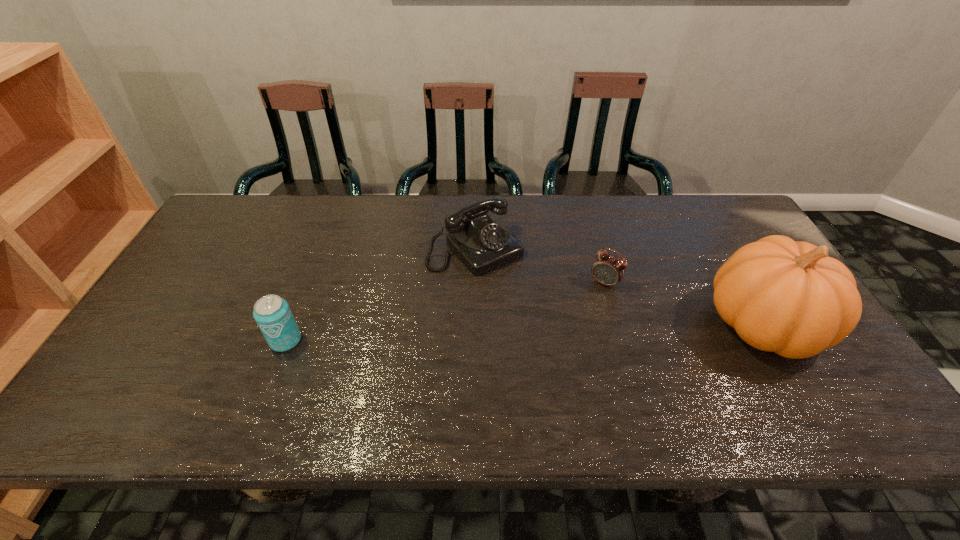
Image resolution: width=960 pixels, height=540 pixels. In order to click on free area in between the leftmost object and the telephone in this screenshot , I will do `click(380, 295)`.

You are a GUI agent. You are given a task and a screenshot of the screen. Output one action in this format:
    pyautogui.click(x=<x>, y=<y>)
    Task: Click on the free spot between the alarm clock and the telephone
    This screenshot has height=540, width=960.
    Given the screenshot: What is the action you would take?
    pyautogui.click(x=540, y=266)

Where is `free space between the beer can and the telephone`? The width and height of the screenshot is (960, 540). free space between the beer can and the telephone is located at coordinates (380, 295).

Select which object appears as the second closest to the second object from right to left. Please provide its 2D coordinates. Your answer should be formatted as a tuple, i.e. [(x, y)], where the tuple contains the x and y coordinates of a point satisfying the conditions above.

[(784, 296)]

This screenshot has height=540, width=960. In order to click on the second closest object to the beer can in this screenshot , I will do `click(607, 269)`.

Identify the location of free space that satisfies the following two spatial constraints: 1. on the back side of the second object from right to left; 2. on the right side of the leftmost object. (308, 282).

The image size is (960, 540). I want to click on free point that satisfies the following two spatial constraints: 1. on the front side of the second object from right to left; 2. on the left side of the rightmost object, so click(616, 325).

This screenshot has width=960, height=540. Find the location of `vacant position in the image that satisfies the following two spatial constraints: 1. on the back side of the pumpkin; 2. on the left side of the beer can`. vacant position in the image that satisfies the following two spatial constraints: 1. on the back side of the pumpkin; 2. on the left side of the beer can is located at coordinates (292, 325).